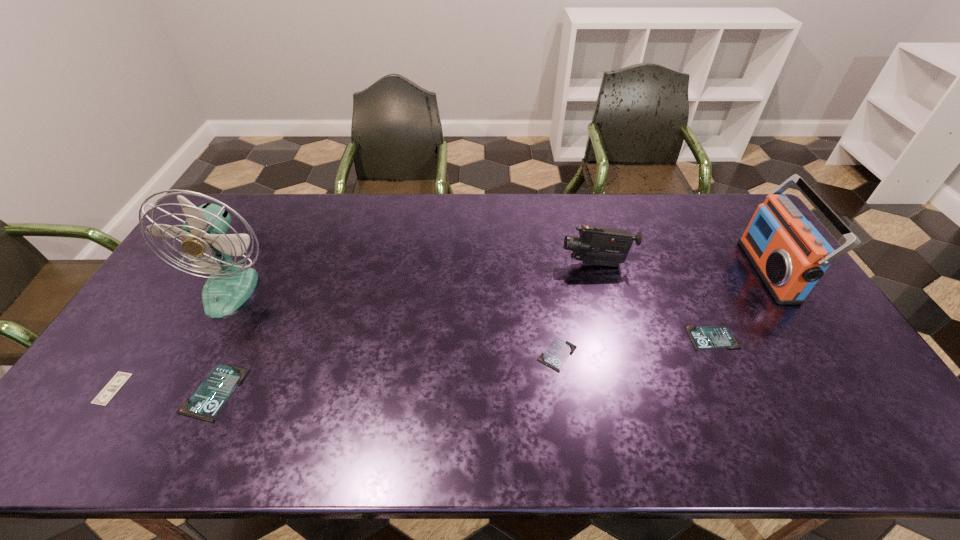
The height and width of the screenshot is (540, 960). Identify the location of money. (108, 392).

The image size is (960, 540). What are the coordinates of `free space located 0.130m on the back of the fourth shortest object` in the screenshot? It's located at (246, 326).

Where is `blank area located on the back of the shortest identity card`? The height and width of the screenshot is (540, 960). blank area located on the back of the shortest identity card is located at coordinates (553, 324).

Locate an element on the screen. vacant space located on the front of the rightmost identity card is located at coordinates (745, 408).

You are a GUI agent. You are given a task and a screenshot of the screen. Output one action in this format:
    pyautogui.click(x=<x>, y=<y>)
    Task: Click on the free space located on the front-facing side of the camcorder
    This screenshot has width=960, height=540.
    Given the screenshot: What is the action you would take?
    pyautogui.click(x=481, y=264)

At what (x,y) coordinates should I click in order to perform the action: click on vacant position located 0.050m on the front-facing side of the camcorder. Please return your answer as a coordinate pair (x, y). This screenshot has width=960, height=540. Looking at the image, I should click on (545, 264).

Where is `blank space located on the front-facing side of the camcorder`? Image resolution: width=960 pixels, height=540 pixels. blank space located on the front-facing side of the camcorder is located at coordinates (534, 264).

Locate an element on the screen. vacant space located in front of the tallest object, directing airflow is located at coordinates (180, 381).

This screenshot has height=540, width=960. Identify the location of vacant region located 0.350m on the front-facing side of the rightmost object. (643, 271).

Locate an element on the screen. The image size is (960, 540). free space located on the front-facing side of the rightmost object is located at coordinates (725, 271).